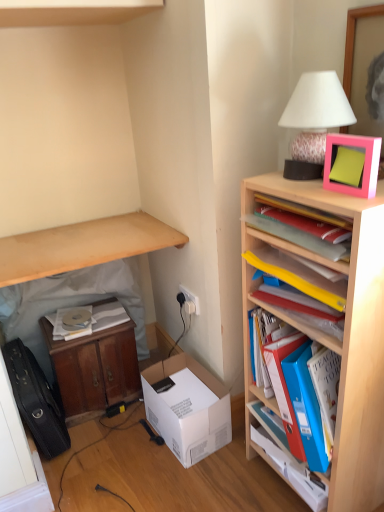
This screenshot has width=384, height=512. Identify the location of vacant area on top of white paper at lower left, arranged as the first book when ordered from the bottom (from a real-world perspective). (77, 316).